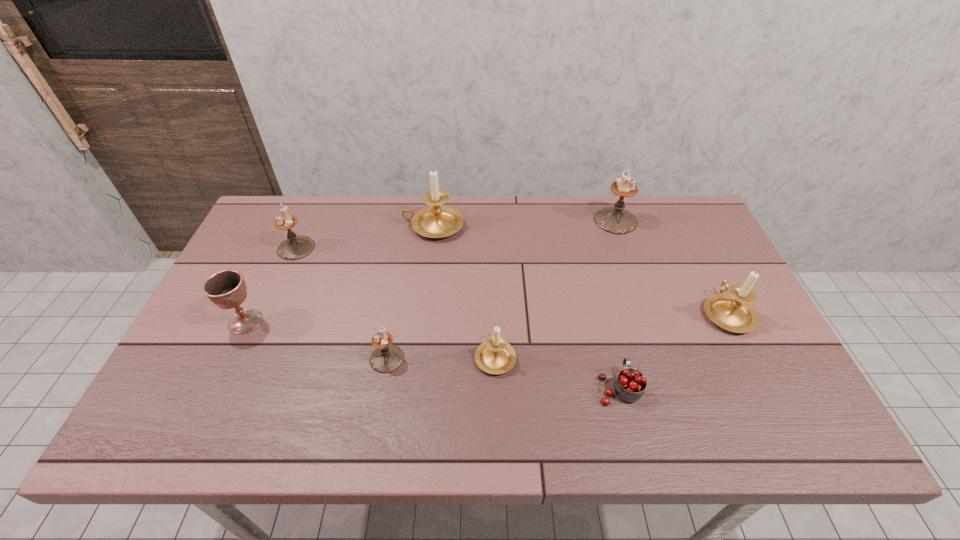
Where is `the fourth candle holder from left to right`? This screenshot has height=540, width=960. the fourth candle holder from left to right is located at coordinates (495, 356).

The image size is (960, 540). I want to click on the nearest purple candle holder, so click(x=388, y=357).

The height and width of the screenshot is (540, 960). What are the coordinates of `the second purple candle holder from right to left` in the screenshot? It's located at (388, 357).

Locate an element on the screen. red cherry is located at coordinates (630, 384).

Find the location of `the shortest object`. the shortest object is located at coordinates (630, 384).

I want to click on free space located on the left of the farthest purple candle holder, so click(533, 220).

Locate an element on the screen. vacant space located with a handle on the side of the leftmost beige candle holder is located at coordinates (375, 226).

Where is `free space located 0.380m with a handle on the side of the leftmost beige candle holder`? The height and width of the screenshot is (540, 960). free space located 0.380m with a handle on the side of the leftmost beige candle holder is located at coordinates (285, 226).

This screenshot has height=540, width=960. What are the coordinates of `free point located 0.310m with a handle on the side of the leftmost beige candle holder` in the screenshot? It's located at (307, 226).

Where is `vacant space located 0.110m on the back of the leftmost candle holder`? vacant space located 0.110m on the back of the leftmost candle holder is located at coordinates (310, 214).